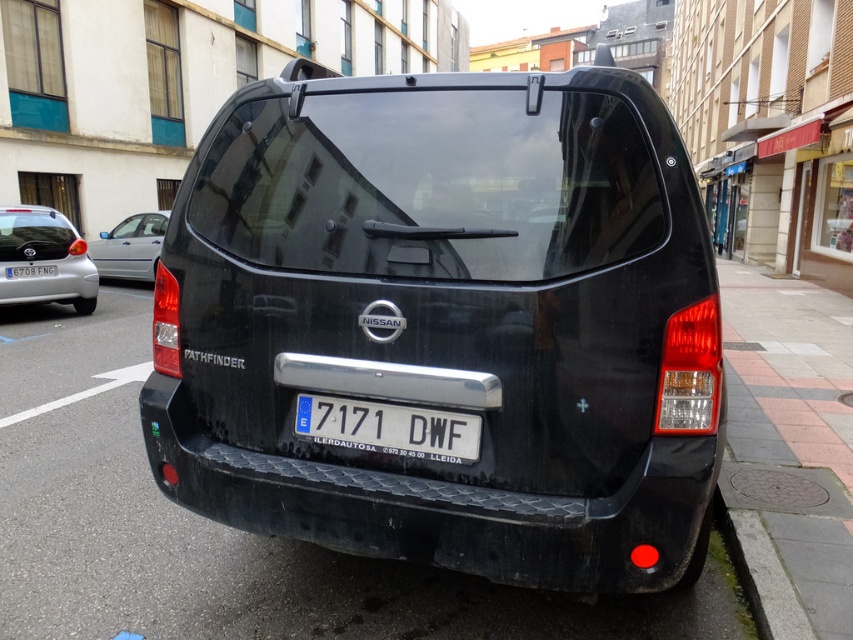
Question: Among these objects, which one is nearest to the camera?

Choices:
 (A) black matte minivan at center
 (B) rubber textured bumper at center
 (C) silver metallic hatchback at left

Answer: (A)

Question: Is rubber textured bumper at center to the right of gray concrete curb at lower right from the viewer's perspective?

Choices:
 (A) no
 (B) yes

Answer: (A)

Question: Which of these objects is positioned farthest from the gray concrete curb at lower right?

Choices:
 (A) black matte minivan at center
 (B) white plastic license plate at center
 (C) rubber textured bumper at center
 (D) silver metallic sedan at left

Answer: (D)

Question: Is black matte minivan at center below gray concrete curb at lower right?

Choices:
 (A) no
 (B) yes

Answer: (A)

Question: Does black matte minivan at center lie in front of silver metallic sedan at left?

Choices:
 (A) no
 (B) yes

Answer: (B)

Question: Which of these objects is positioned farthest from the black matte minivan at center?

Choices:
 (A) rubber textured bumper at center
 (B) white plastic license plate at center
 (C) silver metallic sedan at left

Answer: (C)